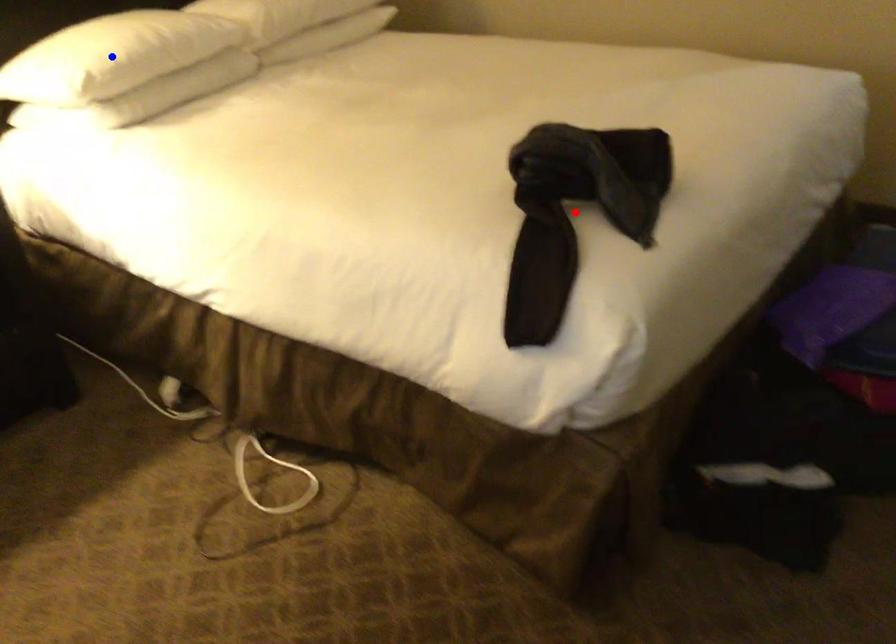
Question: Which of the two points in the image is closer to the camera?

Choices:
 (A) Blue point is closer.
 (B) Red point is closer.

Answer: (B)